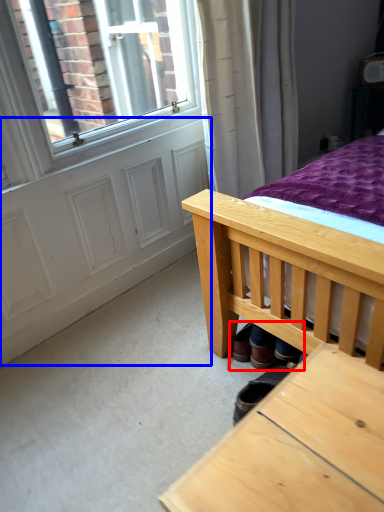
Question: Among these objects, which one is nearest to the camera, shoe (highlighted by a red box) or screen door (highlighted by a blue box)?

Choices:
 (A) shoe
 (B) screen door

Answer: (A)